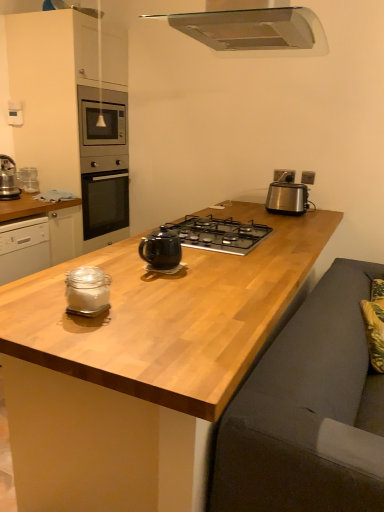
Locate an element on the screen. matte gray cabinetry at upper left, the 2th cabinetry from the bottom is located at coordinates (63, 94).

Where is `black glass gas stove at center`? This screenshot has height=512, width=384. black glass gas stove at center is located at coordinates (219, 234).

Image resolution: width=384 pixels, height=512 pixels. What do you see at coordinates (253, 29) in the screenshot?
I see `metallic stainless steel range hood at upper center` at bounding box center [253, 29].

Measure the distance between point (28, 266) and camera.

2.62 meters.

Image resolution: width=384 pixels, height=512 pixels. What do you see at coordinates (288, 198) in the screenshot? I see `satin silver toaster at right` at bounding box center [288, 198].

At what (x,y) coordinates should I click in order to perform the action: click on matte gray cabinetry at upper left, the 2th cabinetry from the bottom. Please return your answer as a coordinate pair (x, y). The image size is (384, 512). Looking at the image, I should click on (63, 94).

Considering the relative sizes of wooden at center and matte gray cabinetry at upper left, the 1th cabinetry positioned from the top, in the image provided, is wooden at center smaller than matte gray cabinetry at upper left, the 1th cabinetry positioned from the top,?

No, wooden at center is not smaller than matte gray cabinetry at upper left, the 1th cabinetry positioned from the top.

Based on the photo, from a real-world perspective, between wooden at center and matte gray cabinetry at upper left, the 1th cabinetry positioned from the top, who is vertically lower?

wooden at center, from a real-world perspective.

Is wooden at center looking in the opposite direction of matte gray cabinetry at upper left, the 2th cabinetry from the bottom?

No, wooden at center is not facing the opposite direction of matte gray cabinetry at upper left, the 2th cabinetry from the bottom.

Relative to matte gray cabinetry at upper left, the 1th cabinetry positioned from the top, is wooden at center in front or behind?

wooden at center is positioned closer to the viewer than matte gray cabinetry at upper left, the 1th cabinetry positioned from the top.

In the scene shown: Between silver metallic outlet at upper right, the 2th electric outlet in the left-to-right sequence, and clear glass jar at center, which one appears on the right side from the viewer's perspective?

silver metallic outlet at upper right, the 2th electric outlet in the left-to-right sequence.

From a real-world perspective, is silver metallic outlet at upper right, the 2th electric outlet in the left-to-right sequence, over clear glass jar at center?

Yes, from a real-world perspective, silver metallic outlet at upper right, the 2th electric outlet in the left-to-right sequence, is above clear glass jar at center.

Can you see silver metallic outlet at upper right, acting as the first electric outlet starting from the right, touching clear glass jar at center?

No, silver metallic outlet at upper right, acting as the first electric outlet starting from the right, is not making contact with clear glass jar at center.

Locate an element on the screen. kitchen appliance that is on the left side of silver metallic outlet at upper right, the 2th electric outlet in the left-to-right sequence is located at coordinates (87, 291).

Considering the positions of objects black glass gas stove at center and satin silver toaster at upper right, which is the 1th electric outlet in left-to-right order, in the image provided, who is in front, black glass gas stove at center or satin silver toaster at upper right, which is the 1th electric outlet in left-to-right order,?

Positioned in front is black glass gas stove at center.

Is point (262, 236) closer to camera compared to point (285, 170)?

Yes, point (262, 236) is closer to viewer.

Which electric outlet is the 2nd one when counting from the back of the black glass gas stove at center? Please provide its 2D coordinates.

[(284, 175)]

Considering the sizes of objects black glass gas stove at center and satin silver toaster at upper right, the 2th electric outlet positioned from the right, in the image provided, who is thinner, black glass gas stove at center or satin silver toaster at upper right, the 2th electric outlet positioned from the right,?

satin silver toaster at upper right, the 2th electric outlet positioned from the right, is thinner.

Who is more distant, black glossy teapot at center or matte gray cabinetry at upper left, the 2th cabinetry from the bottom?

matte gray cabinetry at upper left, the 2th cabinetry from the bottom.

Is black glossy teapot at center with matte gray cabinetry at upper left, the 1th cabinetry positioned from the top?

→ No, black glossy teapot at center is not touching matte gray cabinetry at upper left, the 1th cabinetry positioned from the top.

From the image's perspective, which is below, black glossy teapot at center or matte gray cabinetry at upper left, the 1th cabinetry positioned from the top?

From the image's view, black glossy teapot at center is below.

This screenshot has height=512, width=384. What are the coordinates of `tea pot below the matte gray cabinetry at upper left, the 2th cabinetry from the bottom (from the image's perspective)` in the screenshot? It's located at (161, 249).

Does clear glass jar at left, which appears as the 1th cabinetry when ordered from the bottom, turn towards satin silver toaster at upper right, the 2th electric outlet positioned from the right?

No, clear glass jar at left, which appears as the 1th cabinetry when ordered from the bottom, is not turned towards satin silver toaster at upper right, the 2th electric outlet positioned from the right.

I want to click on cabinetry below the satin silver toaster at upper right, the 2th electric outlet positioned from the right (from a real-world perspective), so click(x=37, y=234).

From the image's perspective, which is above, clear glass jar at left, which appears as the 1th cabinetry when ordered from the bottom, or satin silver toaster at upper right, the 2th electric outlet positioned from the right?

satin silver toaster at upper right, the 2th electric outlet positioned from the right.

Considering the relative sizes of clear glass jar at left, the second cabinetry in the top-to-bottom sequence, and satin silver toaster at upper right, the 2th electric outlet positioned from the right, in the image provided, is clear glass jar at left, the second cabinetry in the top-to-bottom sequence, smaller than satin silver toaster at upper right, the 2th electric outlet positioned from the right,?

Actually, clear glass jar at left, the second cabinetry in the top-to-bottom sequence, might be larger than satin silver toaster at upper right, the 2th electric outlet positioned from the right.

Considering the relative positions of black glass gas stove at center and satin silver toaster at right in the image provided, is black glass gas stove at center to the right of satin silver toaster at right from the viewer's perspective?

In fact, black glass gas stove at center is to the left of satin silver toaster at right.

Which point is more distant from viewer, (229,245) or (306,189)?

Positioned behind is point (306,189).

Is black glass gas stove at center not near satin silver toaster at right?

black glass gas stove at center is actually quite close to satin silver toaster at right.

Does black glass gas stove at center have a larger size compared to satin silver toaster at right?

Indeed, black glass gas stove at center has a larger size compared to satin silver toaster at right.

Considering the relative sizes of matte gray cabinetry at upper left, the 2th cabinetry from the bottom, and silver metallic outlet at upper right, the 2th electric outlet in the left-to-right sequence, in the image provided, is matte gray cabinetry at upper left, the 2th cabinetry from the bottom, shorter than silver metallic outlet at upper right, the 2th electric outlet in the left-to-right sequence,?

No, matte gray cabinetry at upper left, the 2th cabinetry from the bottom, is not shorter than silver metallic outlet at upper right, the 2th electric outlet in the left-to-right sequence.

Considering the relative sizes of matte gray cabinetry at upper left, the 1th cabinetry positioned from the top, and silver metallic outlet at upper right, the 2th electric outlet in the left-to-right sequence, in the image provided, is matte gray cabinetry at upper left, the 1th cabinetry positioned from the top, thinner than silver metallic outlet at upper right, the 2th electric outlet in the left-to-right sequence,?

No.

From the image's perspective, is matte gray cabinetry at upper left, the 1th cabinetry positioned from the top, located beneath silver metallic outlet at upper right, acting as the first electric outlet starting from the right?

No.

Is matte gray cabinetry at upper left, the 2th cabinetry from the bottom, directly adjacent to silver metallic outlet at upper right, the 2th electric outlet in the left-to-right sequence?

No, matte gray cabinetry at upper left, the 2th cabinetry from the bottom, is not with silver metallic outlet at upper right, the 2th electric outlet in the left-to-right sequence.

Locate an element on the screen. cabinetry that is the 2nd one when counting upward from the wooden at center (from the image's perspective) is located at coordinates (63, 94).

Where is `kitchen appliance in front of the silver metallic outlet at upper right, acting as the first electric outlet starting from the right`? This screenshot has width=384, height=512. kitchen appliance in front of the silver metallic outlet at upper right, acting as the first electric outlet starting from the right is located at coordinates (87, 291).

Estimate the real-world distances between objects in this image. Which object is further from satin silver toaster at upper right, which is the 1th electric outlet in left-to-right order, silver metallic outlet at upper right, the 2th electric outlet in the left-to-right sequence, or metallic stainless steel range hood at upper center?

metallic stainless steel range hood at upper center.

Based on their spatial positions, is silver metallic outlet at upper right, acting as the first electric outlet starting from the right, or satin silver toaster at right closer to black glass gas stove at center?

satin silver toaster at right is closer to black glass gas stove at center.

Looking at the image, which one is located closer to metallic stainless steel range hood at upper center, clear glass jar at center or black glossy teapot at center?

black glossy teapot at center is positioned closer to the anchor metallic stainless steel range hood at upper center.

Considering their positions, is wooden at center positioned closer to matte gray cabinetry at upper left, the 2th cabinetry from the bottom, than metallic stainless steel range hood at upper center?

The object closer to matte gray cabinetry at upper left, the 2th cabinetry from the bottom, is metallic stainless steel range hood at upper center.

Looking at the image, which one is located further to metallic stainless steel range hood at upper center, black glossy teapot at center or clear glass jar at left, which appears as the 1th cabinetry when ordered from the bottom?

clear glass jar at left, which appears as the 1th cabinetry when ordered from the bottom, lies further to metallic stainless steel range hood at upper center than the other object.

From the image, which object appears to be farther from wooden at center, black glass gas stove at center or satin silver toaster at right?

The object further to wooden at center is satin silver toaster at right.

From the image, which object appears to be nearer to satin silver toaster at upper right, the 2th electric outlet positioned from the right, clear glass jar at center or silver metallic outlet at upper right, acting as the first electric outlet starting from the right?

Based on the image, silver metallic outlet at upper right, acting as the first electric outlet starting from the right, appears to be nearer to satin silver toaster at upper right, the 2th electric outlet positioned from the right.

Based on the photo, when comparing their distances from silver metallic outlet at upper right, acting as the first electric outlet starting from the right, does black glass gas stove at center or clear glass jar at left, which appears as the 1th cabinetry when ordered from the bottom, seem further?

Among the two, clear glass jar at left, which appears as the 1th cabinetry when ordered from the bottom, is located further to silver metallic outlet at upper right, acting as the first electric outlet starting from the right.

Image resolution: width=384 pixels, height=512 pixels. I want to click on gas stove between wooden at center and satin silver toaster at right along the z-axis, so click(219, 234).

Find the location of a particular element. kitchen appliance between wooden at center and silver metallic outlet at upper right, acting as the first electric outlet starting from the right, in the front-back direction is located at coordinates (87, 291).

Find the location of a particular element. The width and height of the screenshot is (384, 512). cabinetry between clear glass jar at left, the second cabinetry in the top-to-bottom sequence, and satin silver toaster at right from left to right is located at coordinates (63, 94).

Identify the location of appliance between wooden at center and satin silver toaster at upper right, the 2th electric outlet positioned from the right, from front to back. (288, 198).